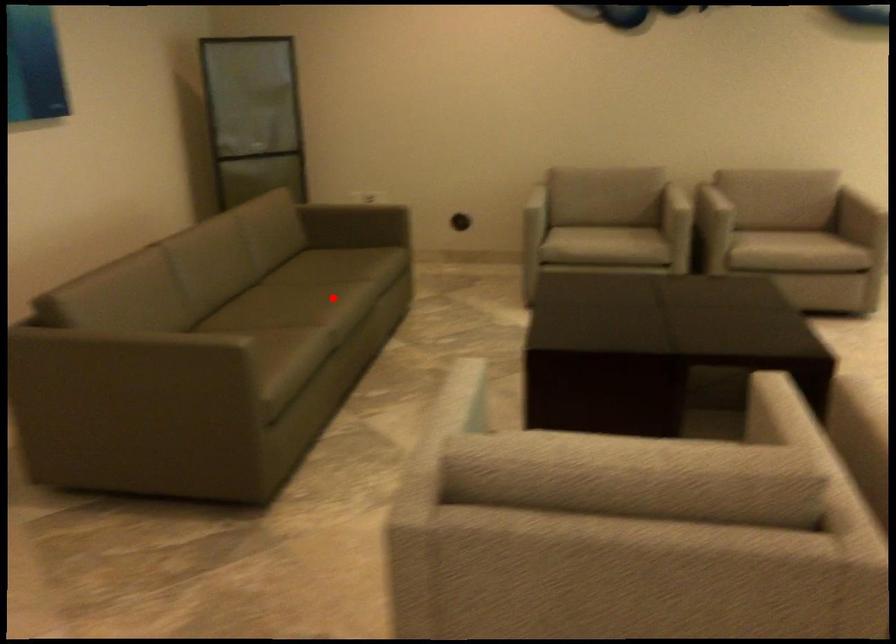
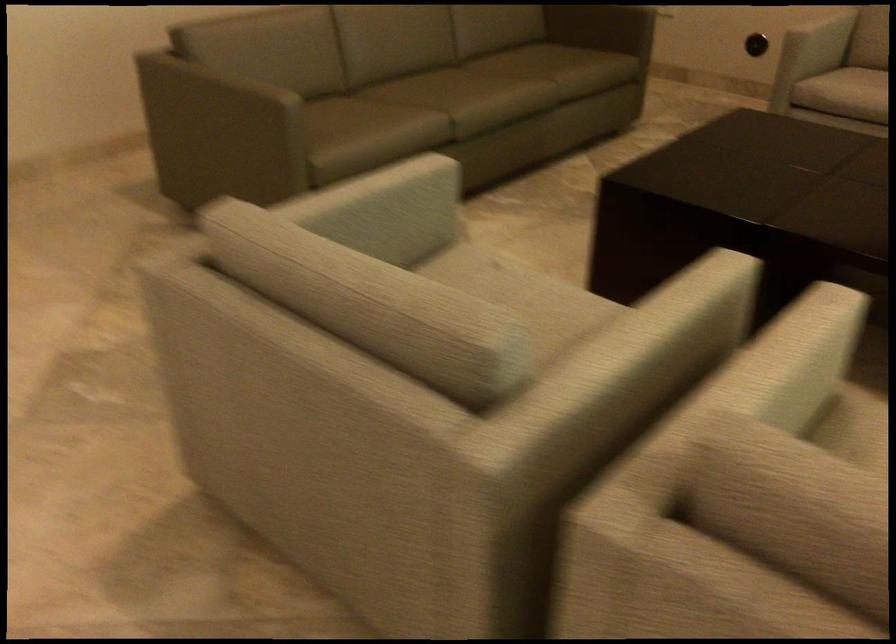
Question: I am providing you with two images of the same scene from different viewpoints. A red point is marked on the first image. Is the red point's position out of view in image 2?

Choices:
 (A) Yes
 (B) No

Answer: (B)